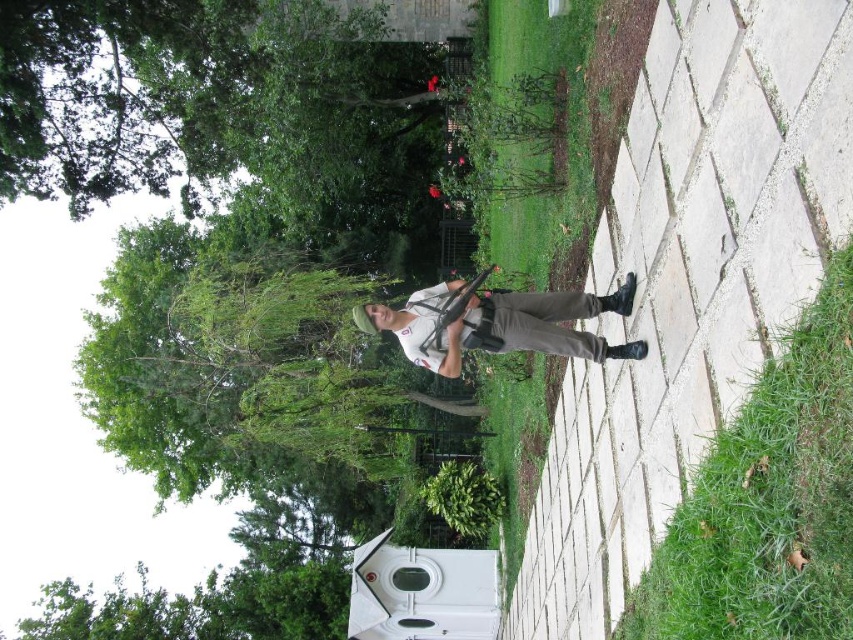
Question: Which point is closer to the camera taking this photo?

Choices:
 (A) (676, 516)
 (B) (590, 211)

Answer: (A)

Question: Considering the relative positions of green grass at lower right and matte white shirt at center in the image provided, where is green grass at lower right located with respect to matte white shirt at center?

Choices:
 (A) left
 (B) right

Answer: (B)

Question: Does green grass at lower right have a smaller size compared to green grass at center?

Choices:
 (A) yes
 (B) no

Answer: (A)

Question: Does green grass at center have a larger size compared to matte white shirt at center?

Choices:
 (A) no
 (B) yes

Answer: (B)

Question: Estimate the real-world distances between objects in this image. Which object is closer to the green grass at center?

Choices:
 (A) green grass at lower right
 (B) matte white shirt at center

Answer: (B)

Question: Among these objects, which one is nearest to the camera?

Choices:
 (A) green grass at center
 (B) green grass at lower right
 (C) matte white shirt at center

Answer: (B)